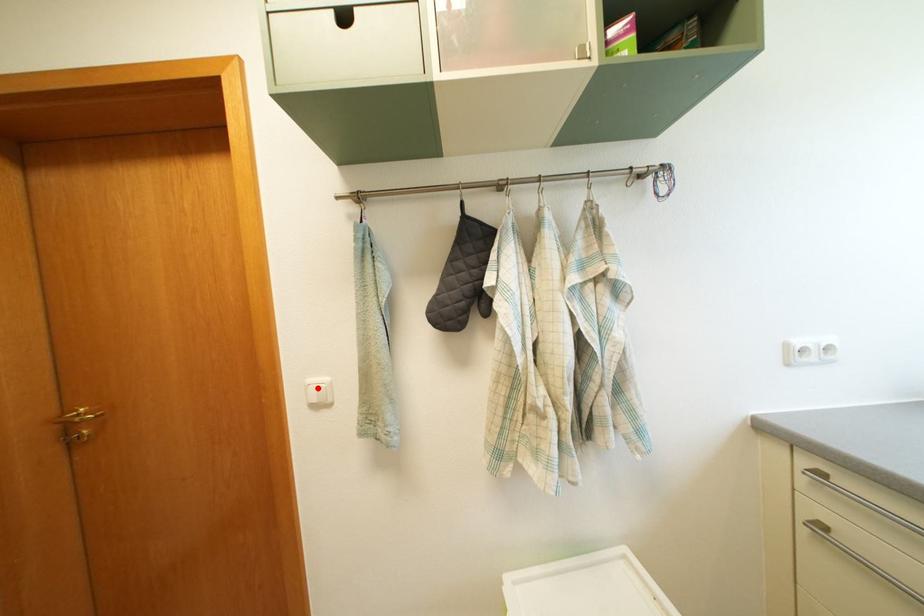
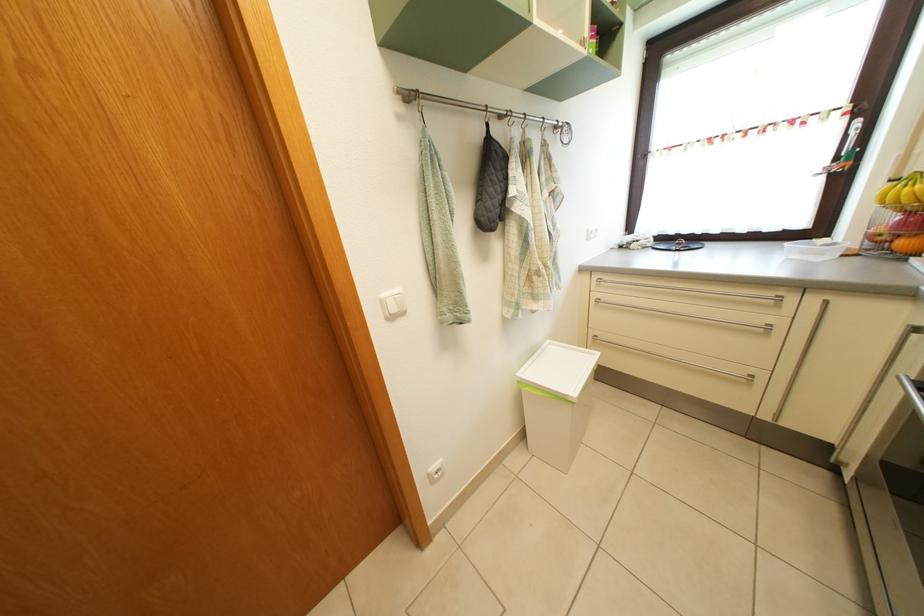
Where in the second image is the point corresponding to the highlighted location from the first image?

(392, 302)